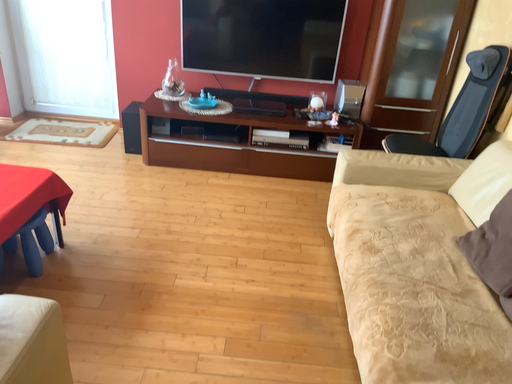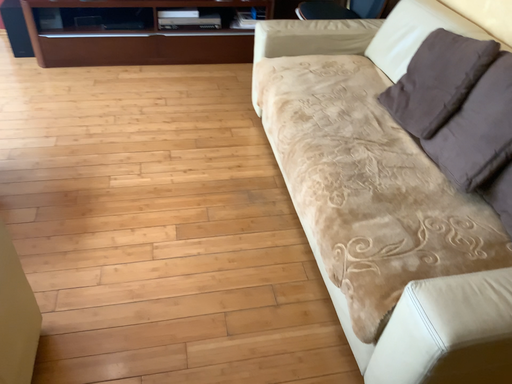
Question: How did the camera likely rotate when shooting the video?

Choices:
 (A) rotated upward
 (B) rotated downward

Answer: (B)